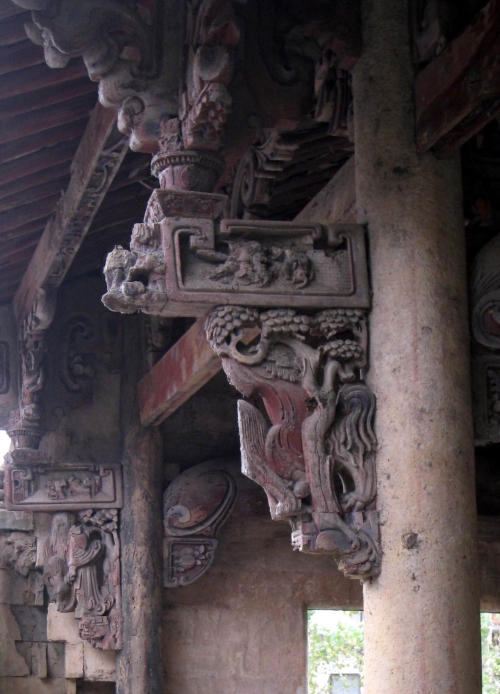
Identify the location of board. The image size is (500, 694). (199, 366).